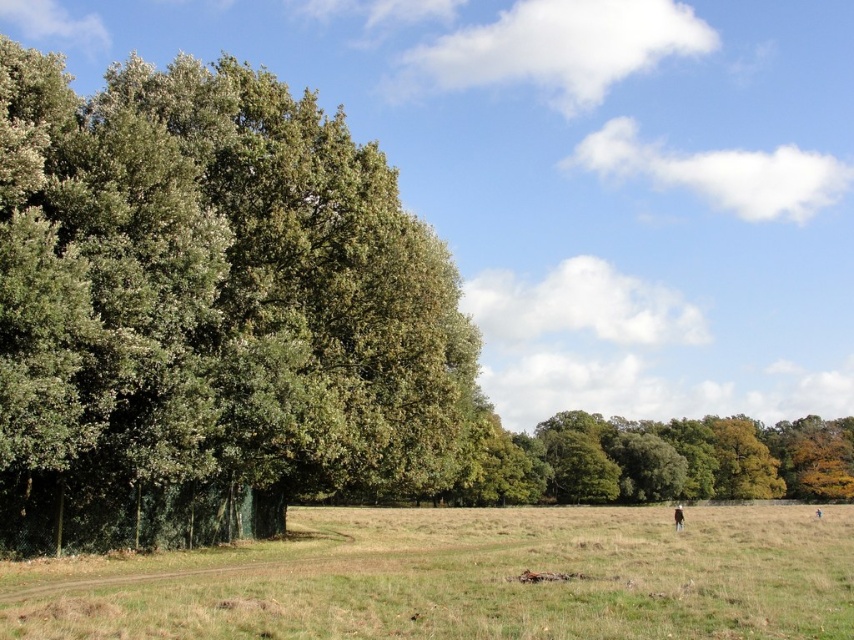
Which of these two, green leafy tree at left or green leafy trees at center, stands taller?

Standing taller between the two is green leafy tree at left.

Is green leafy tree at left positioned at the back of green leafy trees at center?

That is False.

The image size is (854, 640). I want to click on green leafy tree at left, so click(x=208, y=310).

You are a GUI agent. You are given a task and a screenshot of the screen. Output one action in this format:
    pyautogui.click(x=<x>, y=<y>)
    Task: Click on the green leafy tree at left
    
    Given the screenshot: What is the action you would take?
    pyautogui.click(x=208, y=310)

Based on the photo, who is positioned more to the right, green grass at lower center or green leafy trees at center?

Positioned to the right is green leafy trees at center.

Which of these two, green grass at lower center or green leafy trees at center, stands taller?

green leafy trees at center is taller.

Measure the distance between green grass at lower center and camera.

A distance of 11.35 meters exists between green grass at lower center and camera.

The width and height of the screenshot is (854, 640). In order to click on green grass at lower center in this screenshot , I will do `click(463, 577)`.

Looking at this image, is green grass at lower center further to camera compared to brown woolen coat at lower right?

That is False.

Is the position of green grass at lower center less distant than that of brown woolen coat at lower right?

Yes.

Which is behind, point (515, 518) or point (679, 509)?

The point (515, 518) is more distant.

Where is `green grass at lower center`? The height and width of the screenshot is (640, 854). green grass at lower center is located at coordinates (463, 577).